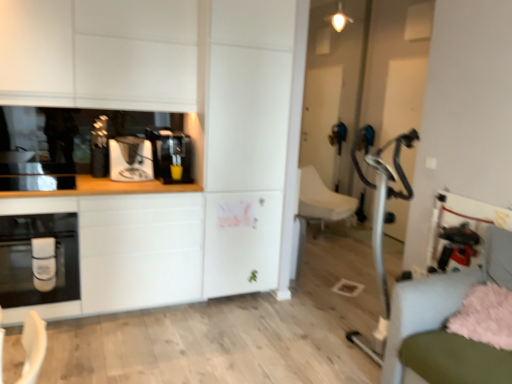
Question: Is black glossy toaster at left not close to white fabric swivel chair at center, placed as the 2th swivel chair when sorted from front to back?

Choices:
 (A) no
 (B) yes

Answer: (B)

Question: Is black glossy toaster at left wider than white fabric swivel chair at center, placed as the 2th swivel chair when sorted from front to back?

Choices:
 (A) yes
 (B) no

Answer: (B)

Question: Can you confirm if black glossy toaster at left is taller than white fabric swivel chair at center, positioned as the first swivel chair in back-to-front order?

Choices:
 (A) no
 (B) yes

Answer: (A)

Question: Is black glossy toaster at left further to camera compared to white fabric swivel chair at center, positioned as the first swivel chair in back-to-front order?

Choices:
 (A) no
 (B) yes

Answer: (A)

Question: Considering the relative sizes of black glossy toaster at left and white fabric swivel chair at center, placed as the 2th swivel chair when sorted from front to back, in the image provided, is black glossy toaster at left shorter than white fabric swivel chair at center, placed as the 2th swivel chair when sorted from front to back,?

Choices:
 (A) no
 (B) yes

Answer: (B)

Question: Can we say black glossy toaster at left lies outside white fabric swivel chair at center, positioned as the first swivel chair in back-to-front order?

Choices:
 (A) yes
 (B) no

Answer: (A)

Question: Does matte black oven at left have a lesser width compared to light blue fabric swivel chair at lower right, acting as the 1th swivel chair starting from the front?

Choices:
 (A) yes
 (B) no

Answer: (A)

Question: Does matte black oven at left have a lesser height compared to light blue fabric swivel chair at lower right, positioned as the second swivel chair in back-to-front order?

Choices:
 (A) yes
 (B) no

Answer: (A)

Question: Is matte black oven at left further to the viewer compared to light blue fabric swivel chair at lower right, acting as the 1th swivel chair starting from the front?

Choices:
 (A) no
 (B) yes

Answer: (B)

Question: From a real-world perspective, is matte black oven at left beneath light blue fabric swivel chair at lower right, positioned as the second swivel chair in back-to-front order?

Choices:
 (A) no
 (B) yes

Answer: (A)

Question: Is matte black oven at left next to light blue fabric swivel chair at lower right, positioned as the second swivel chair in back-to-front order, and touching it?

Choices:
 (A) no
 (B) yes

Answer: (A)

Question: Is matte black oven at left oriented towards light blue fabric swivel chair at lower right, acting as the 1th swivel chair starting from the front?

Choices:
 (A) yes
 (B) no

Answer: (B)

Question: Is fluffy pink pillow at lower right completely or partially outside of white fabric swivel chair at center, positioned as the first swivel chair in back-to-front order?

Choices:
 (A) yes
 (B) no

Answer: (A)